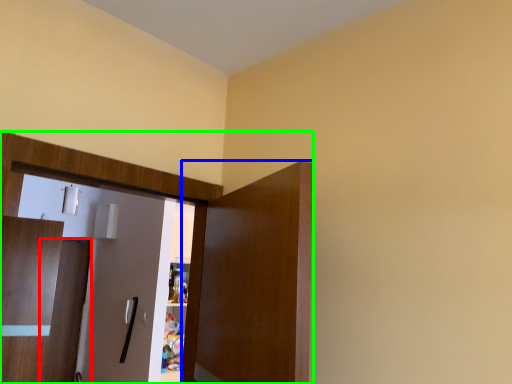
Question: Which object is the closest to the door (highlighted by a red box)? Choose among these: door (highlighted by a blue box) or dresser (highlighted by a green box).

Choices:
 (A) door
 (B) dresser

Answer: (B)